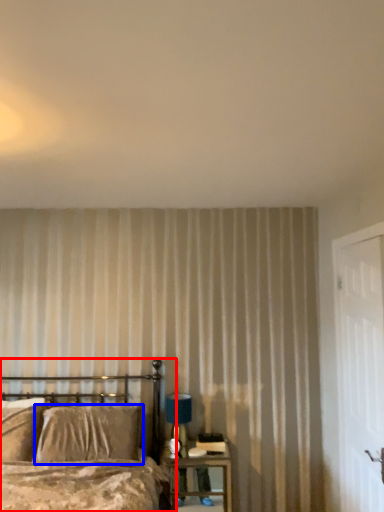
Question: Which object is further to the camera taking this photo, bed (highlighted by a red box) or pillow (highlighted by a blue box)?

Choices:
 (A) bed
 (B) pillow

Answer: (B)